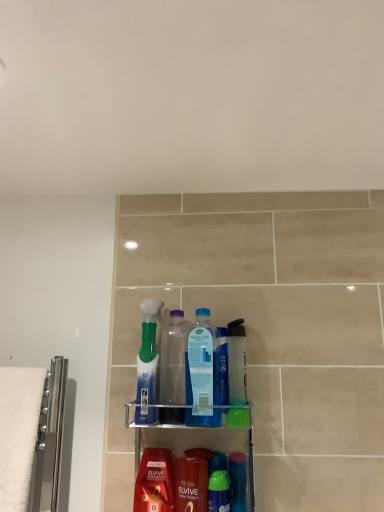
What is the approximate width of transparent plastic bottle at center, the second bottle viewed from the right?

It is 2.78 inches.

How much space does translucent plastic bottle at center, which is the first mouthwash from right to left, occupy horizontally?

6.41 centimeters.

Describe the element at coordinates (155, 482) in the screenshot. I see `translucent plastic mouthwash at lower center, which is the fourth mouthwash from right to left` at that location.

Locate an element on the screen. translucent plastic mouthwash at lower center, which is the third mouthwash from left to right is located at coordinates (237, 481).

Where is `translucent plastic bottles at center`? This screenshot has height=512, width=384. translucent plastic bottles at center is located at coordinates (197, 442).

Where is `transparent plastic bottle at center, the second bottle viewed from the right`? This screenshot has height=512, width=384. transparent plastic bottle at center, the second bottle viewed from the right is located at coordinates (174, 358).

From the image's perspective, which is below, translucent plastic bottles at center or blue plastic bottle at center, the 3th bottle in the left-to-right sequence?

translucent plastic bottles at center appears lower in the image.

Which object is thinner, translucent plastic bottles at center or blue plastic bottle at center, the 3th bottle in the left-to-right sequence?

With smaller width is blue plastic bottle at center, the 3th bottle in the left-to-right sequence.

Where is `shelf below the blue plastic bottle at center, the 3th bottle in the left-to-right sequence (from the image's perspective)`? The image size is (384, 512). shelf below the blue plastic bottle at center, the 3th bottle in the left-to-right sequence (from the image's perspective) is located at coordinates (197, 442).

Is translucent plastic bottles at center in front of or behind blue plastic bottle at center, the 3th bottle in the left-to-right sequence, in the image?

Visually, translucent plastic bottles at center is located in front of blue plastic bottle at center, the 3th bottle in the left-to-right sequence.

Is green plastic mouthwash at center, acting as the third mouthwash starting from the right, with translucent plastic mouthwash at lower center, which is the third mouthwash from left to right?

Yes, green plastic mouthwash at center, acting as the third mouthwash starting from the right, is next to translucent plastic mouthwash at lower center, which is the third mouthwash from left to right.

From a real-world perspective, is green plastic mouthwash at center, which appears as the 2th mouthwash when viewed from the left, located higher than translucent plastic mouthwash at lower center, arranged as the 2th mouthwash when viewed from the right?

No.

Considering the sizes of green plastic mouthwash at center, acting as the third mouthwash starting from the right, and translucent plastic mouthwash at lower center, which is the third mouthwash from left to right, in the image, is green plastic mouthwash at center, acting as the third mouthwash starting from the right, wider or thinner than translucent plastic mouthwash at lower center, which is the third mouthwash from left to right,?

Considering their sizes, green plastic mouthwash at center, acting as the third mouthwash starting from the right, looks slimmer than translucent plastic mouthwash at lower center, which is the third mouthwash from left to right.

Looking at the image, does translucent plastic bottles at center seem bigger or smaller compared to shiny red shampoo at lower center?

Considering their sizes, translucent plastic bottles at center takes up more space than shiny red shampoo at lower center.

From a real-world perspective, is translucent plastic bottles at center positioned under shiny red shampoo at lower center based on gravity?

No, from a real-world perspective, translucent plastic bottles at center is not below shiny red shampoo at lower center.

Where is `cleaning product below the translucent plastic bottles at center (from the image's perspective)`? This screenshot has height=512, width=384. cleaning product below the translucent plastic bottles at center (from the image's perspective) is located at coordinates (191, 485).

Based on the photo, considering the relative sizes of translucent plastic bottles at center and shiny red shampoo at lower center in the image provided, is translucent plastic bottles at center shorter than shiny red shampoo at lower center?

No, translucent plastic bottles at center is not shorter than shiny red shampoo at lower center.

From a real-world perspective, who is located higher, blue plastic bottle at center, marked as the first bottle in a right-to-left arrangement, or shiny red shampoo at lower center?

blue plastic bottle at center, marked as the first bottle in a right-to-left arrangement.

Does blue plastic bottle at center, the 3th bottle in the left-to-right sequence, lie behind shiny red shampoo at lower center?

Yes, it is.

Is blue plastic bottle at center, the 3th bottle in the left-to-right sequence, spatially inside shiny red shampoo at lower center, or outside of it?

blue plastic bottle at center, the 3th bottle in the left-to-right sequence, cannot be found inside shiny red shampoo at lower center.

Does blue plastic bottle at center, the 3th bottle in the left-to-right sequence, come behind translucent plastic mouthwash at lower center, positioned as the first mouthwash in left-to-right order?

That is True.

Is blue plastic bottle at center, the 3th bottle in the left-to-right sequence, shorter than translucent plastic mouthwash at lower center, which is the fourth mouthwash from right to left?

Incorrect, the height of blue plastic bottle at center, the 3th bottle in the left-to-right sequence, does not fall short of that of translucent plastic mouthwash at lower center, which is the fourth mouthwash from right to left.

Which is correct: blue plastic bottle at center, marked as the first bottle in a right-to-left arrangement, is inside translucent plastic mouthwash at lower center, positioned as the first mouthwash in left-to-right order, or outside of it?

blue plastic bottle at center, marked as the first bottle in a right-to-left arrangement, is located beyond the bounds of translucent plastic mouthwash at lower center, positioned as the first mouthwash in left-to-right order.

Which is farther, (211, 365) or (169, 478)?

The point (169, 478) is behind.

Considering the sizes of objects translucent plastic bottle at center, which is the first mouthwash from right to left, and transparent plastic bottle at center, which ranks as the second bottle in left-to-right order, in the image provided, who is bigger, translucent plastic bottle at center, which is the first mouthwash from right to left, or transparent plastic bottle at center, which ranks as the second bottle in left-to-right order,?

transparent plastic bottle at center, which ranks as the second bottle in left-to-right order.

Is transparent plastic bottle at center, which ranks as the second bottle in left-to-right order, inside translucent plastic bottle at center, which is the first mouthwash from right to left?

No, transparent plastic bottle at center, which ranks as the second bottle in left-to-right order, is not surrounded by translucent plastic bottle at center, which is the first mouthwash from right to left.

Which object is closer to the camera taking this photo, translucent plastic bottle at center, which appears as the fourth mouthwash when viewed from the left, or transparent plastic bottle at center, the second bottle viewed from the right?

transparent plastic bottle at center, the second bottle viewed from the right, is in front.

Is translucent plastic bottle at center, which appears as the fourth mouthwash when viewed from the left, shorter than transparent plastic bottle at center, the second bottle viewed from the right?

Correct, translucent plastic bottle at center, which appears as the fourth mouthwash when viewed from the left, is not as tall as transparent plastic bottle at center, the second bottle viewed from the right.

From a real-world perspective, which is physically above, translucent plastic mouthwash at lower center, which is the third mouthwash from left to right, or transparent plastic bottle at center, which ranks as the second bottle in left-to-right order?

In real-world perspective, transparent plastic bottle at center, which ranks as the second bottle in left-to-right order, is above.

Where is `the 2nd bottle located above the translucent plastic mouthwash at lower center, which is the third mouthwash from left to right (from a real-world perspective)`? the 2nd bottle located above the translucent plastic mouthwash at lower center, which is the third mouthwash from left to right (from a real-world perspective) is located at coordinates (174, 358).

Which is in front, translucent plastic mouthwash at lower center, arranged as the 2th mouthwash when viewed from the right, or transparent plastic bottle at center, which ranks as the second bottle in left-to-right order?

Positioned in front is translucent plastic mouthwash at lower center, arranged as the 2th mouthwash when viewed from the right.

Which object is positioned more to the right, translucent plastic mouthwash at lower center, which is the third mouthwash from left to right, or transparent plastic bottle at center, which ranks as the second bottle in left-to-right order?

From the viewer's perspective, translucent plastic mouthwash at lower center, which is the third mouthwash from left to right, appears more on the right side.

From the image's perspective, which bottle is the 2nd one above the translucent plastic bottles at center? Please provide its 2D coordinates.

[(203, 373)]

This screenshot has width=384, height=512. In order to click on mouthwash below the translucent plastic mouthwash at lower center, arranged as the 2th mouthwash when viewed from the right (from the image's perspective) in this screenshot , I will do `click(219, 492)`.

Estimate the real-world distances between objects in this image. Which object is further from translucent plastic bottle at center, which appears as the fourth mouthwash when viewed from the left, green plastic mouthwash at center, which appears as the 2th mouthwash when viewed from the left, or translucent green bottle at center, the first bottle viewed from the left?

Among the two, green plastic mouthwash at center, which appears as the 2th mouthwash when viewed from the left, is located further to translucent plastic bottle at center, which appears as the fourth mouthwash when viewed from the left.

When comparing their distances from blue plastic bottle at center, marked as the first bottle in a right-to-left arrangement, does transparent plastic bottle at center, the second bottle viewed from the right, or translucent plastic mouthwash at lower center, positioned as the first mouthwash in left-to-right order, seem closer?

transparent plastic bottle at center, the second bottle viewed from the right, is closer to blue plastic bottle at center, marked as the first bottle in a right-to-left arrangement.

From the image, which object appears to be nearer to green plastic mouthwash at center, acting as the third mouthwash starting from the right, translucent green bottle at center, which is the 3th bottle in right-to-left order, or translucent plastic mouthwash at lower center, which is the fourth mouthwash from right to left?

translucent plastic mouthwash at lower center, which is the fourth mouthwash from right to left, is positioned closer to the anchor green plastic mouthwash at center, acting as the third mouthwash starting from the right.

Considering their positions, is translucent plastic mouthwash at lower center, positioned as the first mouthwash in left-to-right order, positioned further to translucent green bottle at center, which is the 3th bottle in right-to-left order, than translucent plastic mouthwash at lower center, arranged as the 2th mouthwash when viewed from the right?

translucent plastic mouthwash at lower center, arranged as the 2th mouthwash when viewed from the right.

From the image, which object appears to be nearer to translucent plastic mouthwash at lower center, arranged as the 2th mouthwash when viewed from the right, transparent plastic bottle at center, which ranks as the second bottle in left-to-right order, or translucent plastic bottles at center?

translucent plastic bottles at center.

From the picture: From the image, which object appears to be farther from transparent plastic bottle at center, the second bottle viewed from the right, translucent plastic bottle at center, which is the first mouthwash from right to left, or translucent plastic bottles at center?

translucent plastic bottle at center, which is the first mouthwash from right to left, lies further to transparent plastic bottle at center, the second bottle viewed from the right, than the other object.

Estimate the real-world distances between objects in this image. Which object is closer to translucent plastic bottles at center, translucent plastic mouthwash at lower center, arranged as the 2th mouthwash when viewed from the right, or translucent plastic mouthwash at lower center, positioned as the first mouthwash in left-to-right order?

Based on the image, translucent plastic mouthwash at lower center, positioned as the first mouthwash in left-to-right order, appears to be nearer to translucent plastic bottles at center.

Estimate the real-world distances between objects in this image. Which object is further from translucent green bottle at center, which is the 3th bottle in right-to-left order, blue plastic bottle at center, the 3th bottle in the left-to-right sequence, or translucent plastic bottles at center?

translucent plastic bottles at center.

The height and width of the screenshot is (512, 384). I want to click on shelf between translucent green bottle at center, which is the 3th bottle in right-to-left order, and shiny red shampoo at lower center vertically, so click(197, 442).

What are the coordinates of `mouthwash between translucent plastic mouthwash at lower center, positioned as the first mouthwash in left-to-right order, and translucent plastic mouthwash at lower center, which is the third mouthwash from left to right, from left to right` in the screenshot? It's located at (219, 492).

At what (x,y) coordinates should I click in order to perform the action: click on shelf between translucent green bottle at center, which is the 3th bottle in right-to-left order, and translucent plastic mouthwash at lower center, positioned as the first mouthwash in left-to-right order, vertically. Please return your answer as a coordinate pair (x, y). The width and height of the screenshot is (384, 512). Looking at the image, I should click on (197, 442).

Where is `mouthwash located between shiny red shampoo at lower center and translucent plastic mouthwash at lower center, arranged as the 2th mouthwash when viewed from the right, in the left-right direction`? This screenshot has height=512, width=384. mouthwash located between shiny red shampoo at lower center and translucent plastic mouthwash at lower center, arranged as the 2th mouthwash when viewed from the right, in the left-right direction is located at coordinates (219, 492).